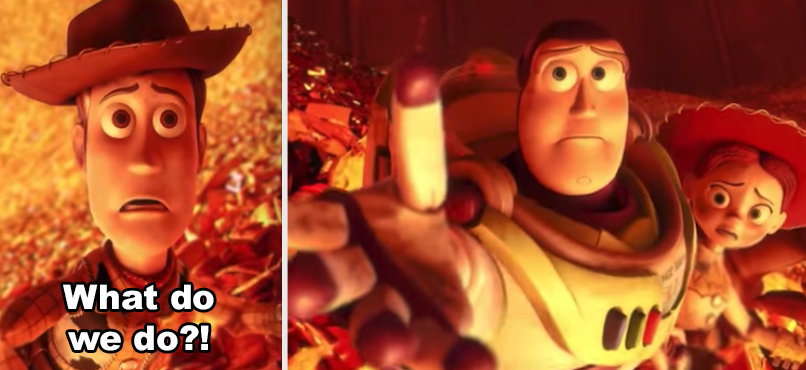
Where is `toy`? toy is located at coordinates (588, 114).